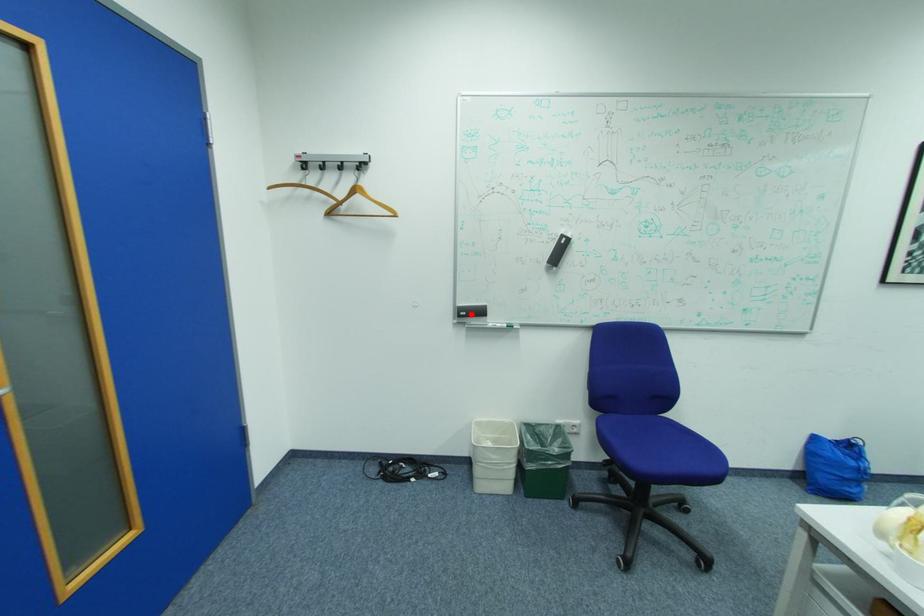
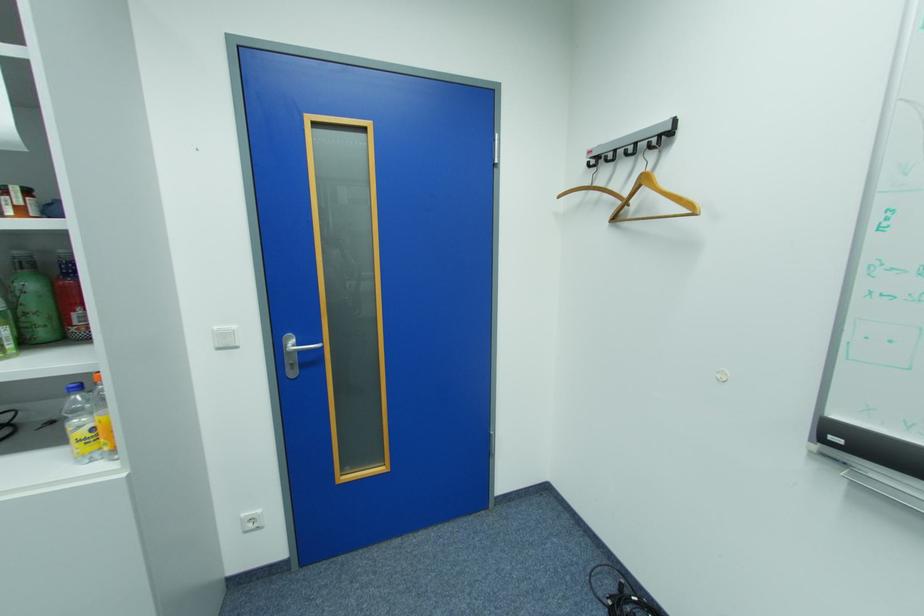
In the second image, find the point that corresponds to the highlighted location in the first image.

(845, 440)